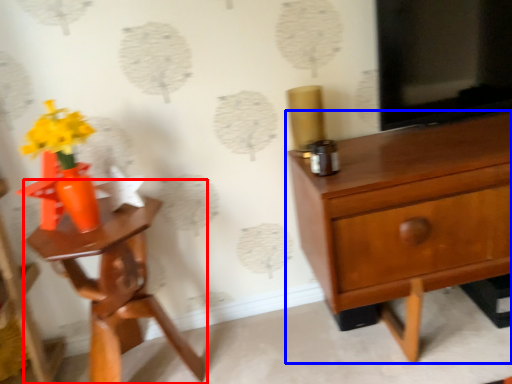
Question: Which object appears closest to the camera in this image, nightstand (highlighted by a red box) or chest of drawers (highlighted by a blue box)?

Choices:
 (A) nightstand
 (B) chest of drawers

Answer: (A)